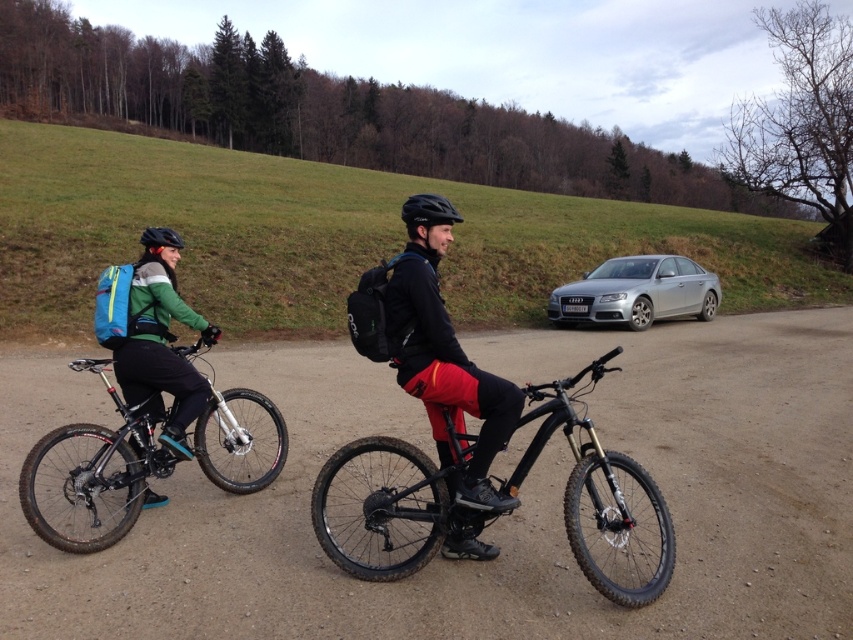
Does matte black jacket at center have a greater width compared to teal fabric backpack at left?

Yes.

Does matte black jacket at center have a lesser height compared to teal fabric backpack at left?

Incorrect, matte black jacket at center's height does not fall short of teal fabric backpack at left's.

Find the location of a particular element. The height and width of the screenshot is (640, 853). matte black jacket at center is located at coordinates click(x=445, y=369).

Locate an element on the screen. The width and height of the screenshot is (853, 640). matte black jacket at center is located at coordinates (x=445, y=369).

Can you confirm if shiny black frame at center is positioned below matte black bicycle at left?

Yes.

Between point (639, 472) and point (94, 490), which one is positioned in front?

Point (639, 472) is more forward.

This screenshot has width=853, height=640. What are the coordinates of `shiny black frame at center` in the screenshot? It's located at (392, 506).

Which of these two, matte black bicycle at left or black matte helmet at upper left, stands shorter?

matte black bicycle at left is shorter.

At what (x,y) coordinates should I click in order to perform the action: click on matte black bicycle at left. Please return your answer as a coordinate pair (x, y). This screenshot has width=853, height=640. Looking at the image, I should click on click(x=90, y=476).

Is point (59, 525) positioned behind point (152, 236)?

No.

Find the location of a particular element. This screenshot has height=640, width=853. matte black bicycle at left is located at coordinates (90, 476).